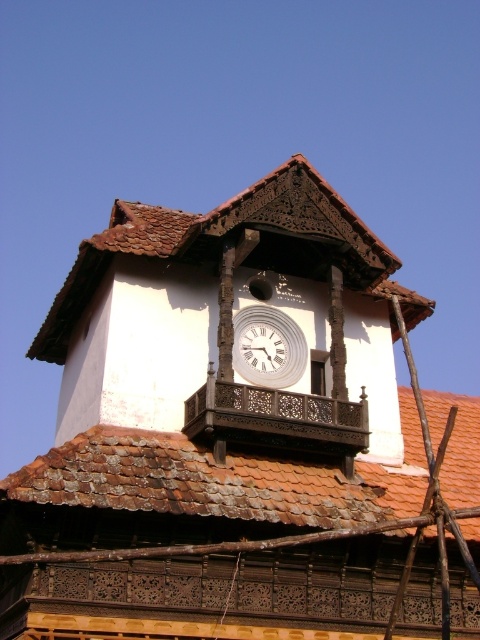
Question: Does rusty tiled roof at center appear on the right side of white glossy clock at center?

Choices:
 (A) yes
 (B) no

Answer: (A)

Question: Which point is farther to the camera?

Choices:
 (A) white glossy clock at center
 (B) white wooden clock at center
 (C) brown tiled roof at upper center
 (D) rusty tiled roof at center

Answer: (B)

Question: Considering the real-world distances, which object is farthest from the white glossy clock at center?

Choices:
 (A) brown tiled roof at upper center
 (B) rusty tiled roof at center

Answer: (B)

Question: Does rusty tiled roof at center have a greater width compared to brown tiled roof at upper center?

Choices:
 (A) yes
 (B) no

Answer: (A)

Question: Is brown tiled roof at upper center positioned in front of white glossy clock at center?

Choices:
 (A) yes
 (B) no

Answer: (A)

Question: Estimate the real-world distances between objects in this image. Which object is closer to the rusty tiled roof at center?

Choices:
 (A) brown tiled roof at upper center
 (B) white glossy clock at center
 (C) white wooden clock at center

Answer: (B)